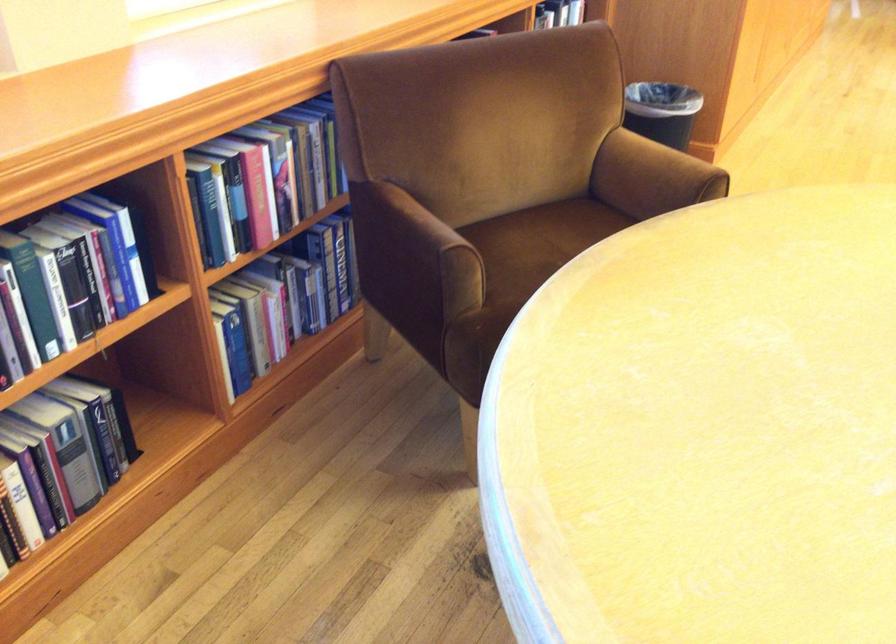
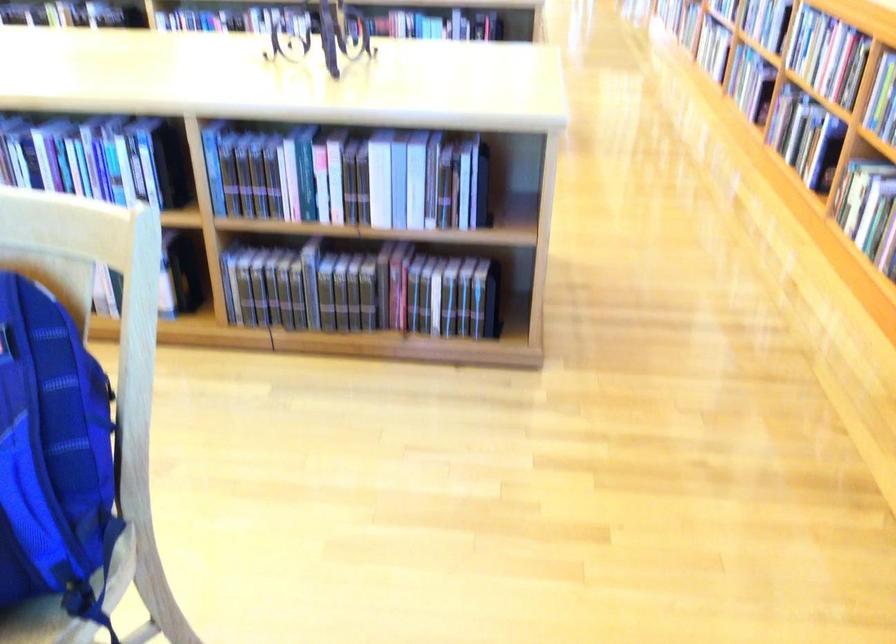
The first image is from the beginning of the video and the second image is from the end. How did the camera likely rotate when shooting the video?

The camera rotated toward right-down.